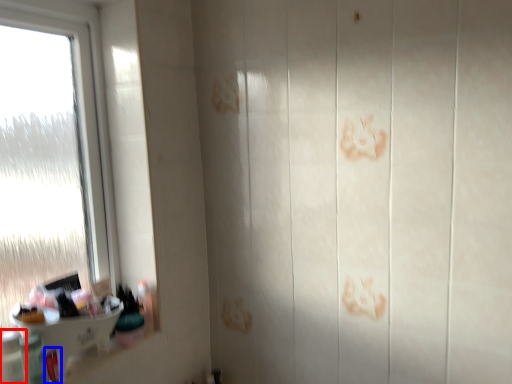
Question: Which object is closer to the camera taking this photo, toiletry (highlighted by a red box) or toiletry (highlighted by a blue box)?

Choices:
 (A) toiletry
 (B) toiletry

Answer: (A)